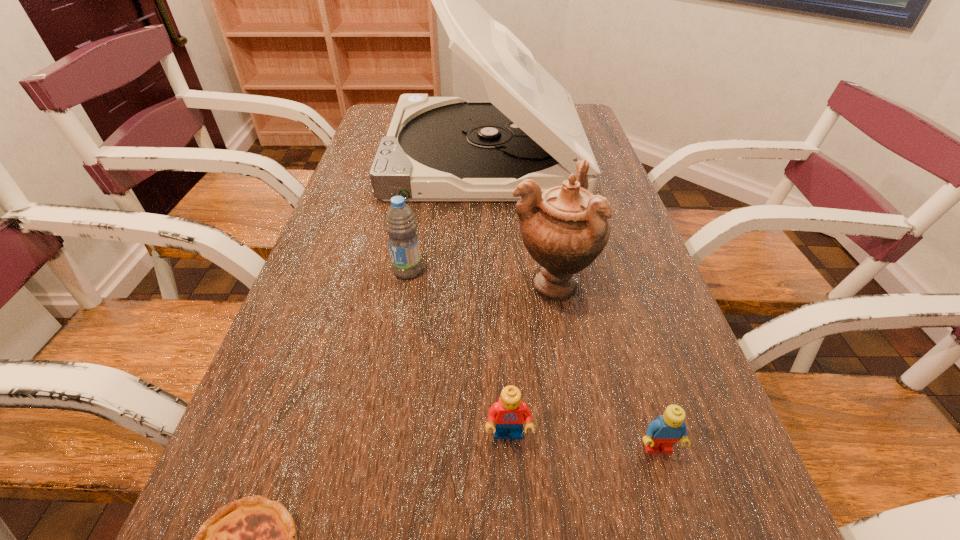
Locate an element on the screen. This screenshot has width=960, height=540. free space located 0.060m on the face of the right Lego is located at coordinates (674, 501).

Identify the location of object located in the far edge section of the desktop. This screenshot has height=540, width=960. (437, 148).

At what (x,y) coordinates should I click in order to perform the action: click on object situated at the left edge. Please return your answer as a coordinate pair (x, y). The width and height of the screenshot is (960, 540). Looking at the image, I should click on (437, 148).

Where is `CD player present at the right edge`? The width and height of the screenshot is (960, 540). CD player present at the right edge is located at coordinates (437, 148).

Locate an element on the screen. This screenshot has height=540, width=960. urn present at the right edge is located at coordinates (565, 228).

What are the coordinates of `Lego positioned at the right edge` in the screenshot? It's located at (662, 433).

The width and height of the screenshot is (960, 540). What are the coordinates of `object located at the far left corner` in the screenshot? It's located at (437, 148).

Locate an element on the screen. The height and width of the screenshot is (540, 960). object situated at the far right corner is located at coordinates (437, 148).

In the image, there is a desktop. Where is `vacant space at the left edge`? Image resolution: width=960 pixels, height=540 pixels. vacant space at the left edge is located at coordinates (329, 363).

The height and width of the screenshot is (540, 960). In the image, there is a desktop. In order to click on vacant space at the right edge in this screenshot , I will do `click(634, 219)`.